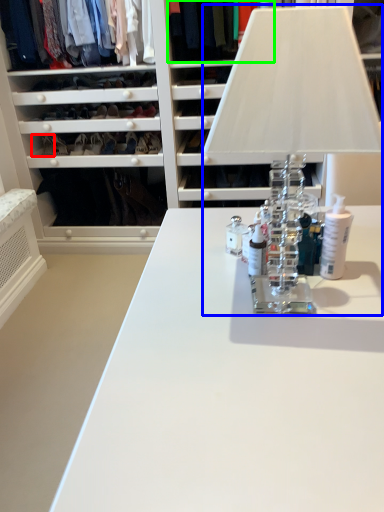
Question: Based on their relative distances, which object is nearer to shoe (highlighted by a red box)? Choose from table lamp (highlighted by a blue box) and clothing (highlighted by a green box).

Choices:
 (A) table lamp
 (B) clothing

Answer: (B)